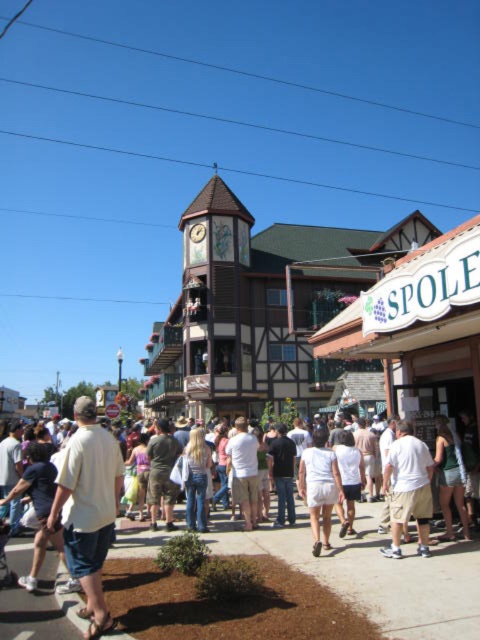
Who is taller, brown wooden clock tower at center or light beige shorts at center?

With more height is brown wooden clock tower at center.

Is point (239, 314) closer to viewer compared to point (399, 477)?

That is False.

Describe the element at coordinates (216, 305) in the screenshot. This screenshot has width=480, height=640. I see `brown wooden clock tower at center` at that location.

Where is `brown wooden clock tower at center`? This screenshot has height=640, width=480. brown wooden clock tower at center is located at coordinates (216, 305).

Is point (412, 472) closer to camera compared to point (323, 516)?

Yes, point (412, 472) is closer to viewer.

Between light beige shorts at center and white cotton shorts at center, which one appears on the right side from the viewer's perspective?

From the viewer's perspective, light beige shorts at center appears more on the right side.

Image resolution: width=480 pixels, height=640 pixels. Describe the element at coordinates (408, 488) in the screenshot. I see `light beige shorts at center` at that location.

Where is `light beige shorts at center`? Image resolution: width=480 pixels, height=640 pixels. light beige shorts at center is located at coordinates (408, 488).

Is brown wooden clock tower at center taller than wooden clock at center?

Correct, brown wooden clock tower at center is much taller as wooden clock at center.

Image resolution: width=480 pixels, height=640 pixels. Identify the location of brown wooden clock tower at center. (216, 305).

This screenshot has width=480, height=640. Identify the location of brown wooden clock tower at center. (216, 305).